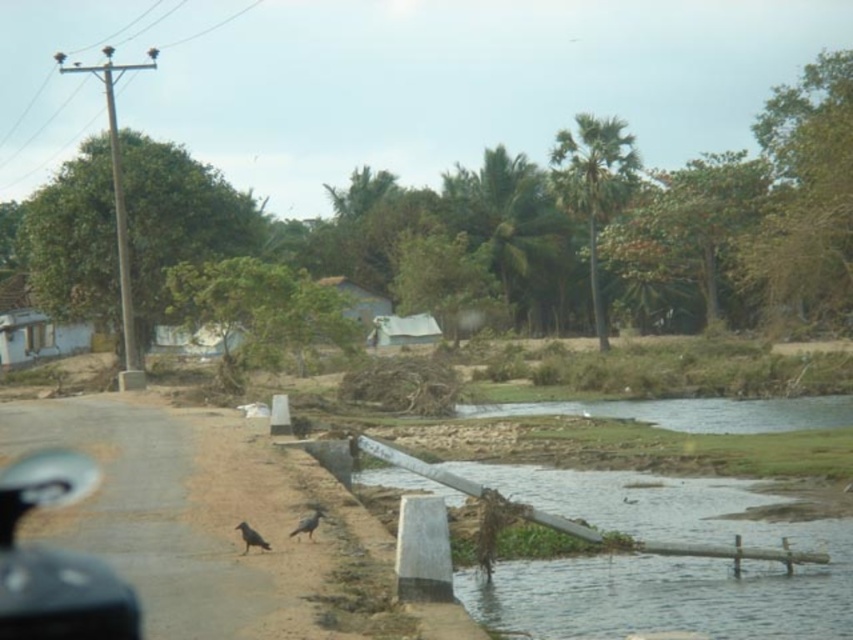
You are a cyclist approaching the black rubber handlebar at lower left and the dark gray feathered bird at lower left. Which object is taller?

The black rubber handlebar at lower left is taller than the dark gray feathered bird at lower left according to the description.

You are standing at the starting point of the road in the rural scene. You notice two points marked on the road. The first point is at coordinates point (4, 608) and the second is at point (318, 508). Which point is closer to you as you face the direction the road curves to the left?

Point (4, 608) is closer to you because it is in front of point (318, 508) when facing the direction the road curves to the left.